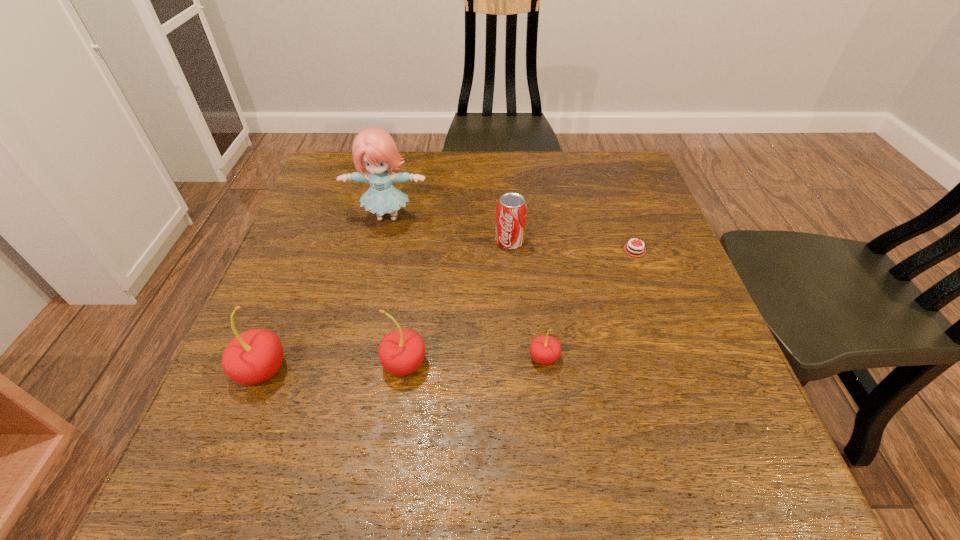
Image resolution: width=960 pixels, height=540 pixels. I want to click on the leftmost object, so click(x=252, y=357).

At what (x,y) coordinates should I click in order to perform the action: click on the second shortest cherry. Please return your answer as a coordinate pair (x, y). Image resolution: width=960 pixels, height=540 pixels. Looking at the image, I should click on (401, 352).

What are the coordinates of `the third tallest object` in the screenshot? It's located at (401, 352).

Find the location of a particular element. the second shortest object is located at coordinates (544, 349).

Locate an element on the screen. the shortest cherry is located at coordinates (544, 349).

This screenshot has width=960, height=540. Find the location of `the tallest object`. the tallest object is located at coordinates (374, 149).

Locate an element on the screen. the farthest object is located at coordinates (374, 149).

The width and height of the screenshot is (960, 540). Find the location of `the rightmost object`. the rightmost object is located at coordinates (640, 251).

Where is `the shortest object`? This screenshot has height=540, width=960. the shortest object is located at coordinates (640, 251).

At what (x,y) coordinates should I click in order to perform the action: click on the third shortest object. Please return your answer as a coordinate pair (x, y). The height and width of the screenshot is (540, 960). Looking at the image, I should click on (511, 209).